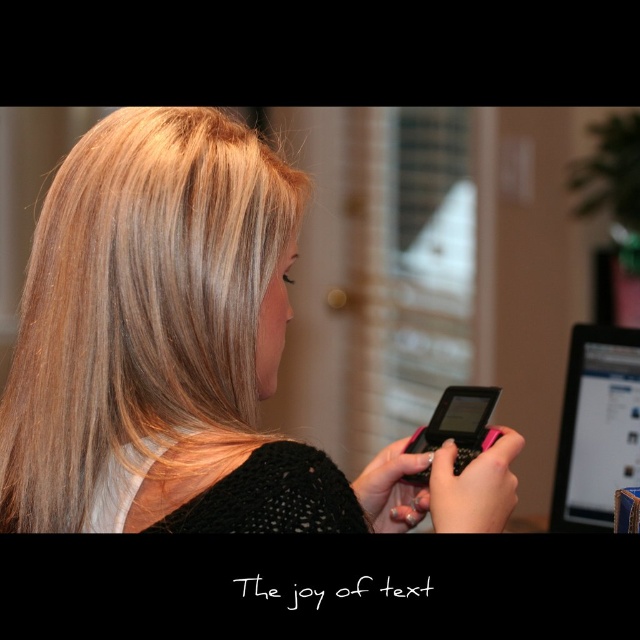
Does matte black computer at right appear on the left side of pink matte smartphone at center?

Incorrect, matte black computer at right is not on the left side of pink matte smartphone at center.

Consider the image. Can you confirm if matte black computer at right is shorter than pink matte smartphone at center?

Incorrect, matte black computer at right's height does not fall short of pink matte smartphone at center's.

Identify the location of matte black computer at right. click(596, 428).

Is blonde hair at center above pink matte smartphone at center?

Yes, blonde hair at center is above pink matte smartphone at center.

Who is more distant from viewer, (54, 188) or (461, 432)?

The point (461, 432) is more distant.

Between point (140, 404) and point (436, 444), which one is positioned behind?

Positioned behind is point (436, 444).

The height and width of the screenshot is (640, 640). I want to click on blonde hair at center, so click(186, 349).

Is point (458, 400) in front of point (296, 596)?

No, (458, 400) is behind (296, 596).

This screenshot has width=640, height=640. What are the coordinates of `pink matte smartphone at center` in the screenshot? It's located at (458, 422).